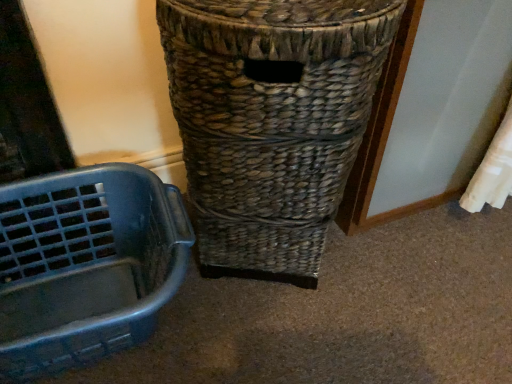
Question: Can you confirm if blue plastic basket at left is wider than woven brown basket at center?

Choices:
 (A) yes
 (B) no

Answer: (B)

Question: Is blue plastic basket at left to the right of woven brown basket at center from the viewer's perspective?

Choices:
 (A) yes
 (B) no

Answer: (B)

Question: Is blue plastic basket at left positioned before woven brown basket at center?

Choices:
 (A) no
 (B) yes

Answer: (A)

Question: Is blue plastic basket at left directly adjacent to woven brown basket at center?

Choices:
 (A) no
 (B) yes

Answer: (A)

Question: From the image's perspective, does blue plastic basket at left appear lower than woven brown basket at center?

Choices:
 (A) yes
 (B) no

Answer: (A)

Question: Considering the relative sizes of blue plastic basket at left and woven brown basket at center in the image provided, is blue plastic basket at left bigger than woven brown basket at center?

Choices:
 (A) yes
 (B) no

Answer: (B)

Question: Would you say blue plastic basket at left is part of woven brown basket at center's contents?

Choices:
 (A) yes
 (B) no

Answer: (B)

Question: Can you confirm if woven brown basket at center is shorter than blue plastic basket at left?

Choices:
 (A) yes
 (B) no

Answer: (B)

Question: Does woven brown basket at center appear on the left side of blue plastic basket at left?

Choices:
 (A) no
 (B) yes

Answer: (A)

Question: Does woven brown basket at center have a greater height compared to blue plastic basket at left?

Choices:
 (A) no
 (B) yes

Answer: (B)

Question: From a real-world perspective, is woven brown basket at center located higher than blue plastic basket at left?

Choices:
 (A) yes
 (B) no

Answer: (A)

Question: From the image's perspective, is woven brown basket at center on blue plastic basket at left?

Choices:
 (A) yes
 (B) no

Answer: (A)

Question: Is blue plastic basket at left inside the boundaries of woven brown basket at center, or outside?

Choices:
 (A) outside
 (B) inside

Answer: (A)